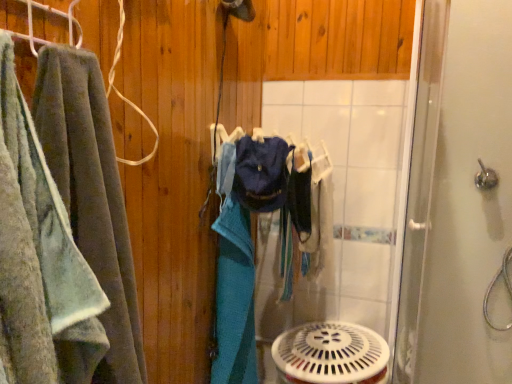
Question: Considering the relative sizes of white plastic mechanical fan at lower center and clear glass shower door at right in the image provided, is white plastic mechanical fan at lower center taller than clear glass shower door at right?

Choices:
 (A) no
 (B) yes

Answer: (A)

Question: Is the position of white plastic mechanical fan at lower center more distant than that of clear glass shower door at right?

Choices:
 (A) no
 (B) yes

Answer: (B)

Question: Could you tell me if white plastic mechanical fan at lower center is facing clear glass shower door at right?

Choices:
 (A) no
 (B) yes

Answer: (A)

Question: Can you confirm if white plastic mechanical fan at lower center is positioned to the left of clear glass shower door at right?

Choices:
 (A) no
 (B) yes

Answer: (B)

Question: Considering the relative sizes of white plastic mechanical fan at lower center and clear glass shower door at right in the image provided, is white plastic mechanical fan at lower center bigger than clear glass shower door at right?

Choices:
 (A) no
 (B) yes

Answer: (A)

Question: Considering the positions of point (62, 360) and point (484, 365), is point (62, 360) closer or farther from the camera than point (484, 365)?

Choices:
 (A) farther
 (B) closer

Answer: (B)

Question: Relative to clear glass shower door at right, is soft green towel at left in front or behind?

Choices:
 (A) behind
 (B) front

Answer: (B)

Question: Is soft green towel at left inside the boundaries of clear glass shower door at right, or outside?

Choices:
 (A) inside
 (B) outside

Answer: (B)

Question: From the image's perspective, relative to clear glass shower door at right, is soft green towel at left above or below?

Choices:
 (A) below
 (B) above

Answer: (B)

Question: Considering the positions of white plastic mechanical fan at lower center and silver metallic shower handle at upper right in the image, is white plastic mechanical fan at lower center bigger or smaller than silver metallic shower handle at upper right?

Choices:
 (A) big
 (B) small

Answer: (A)

Question: Is point (356, 382) positioned closer to the camera than point (479, 188)?

Choices:
 (A) farther
 (B) closer

Answer: (B)

Question: In terms of height, does white plastic mechanical fan at lower center look taller or shorter compared to silver metallic shower handle at upper right?

Choices:
 (A) tall
 (B) short

Answer: (A)

Question: From a real-world perspective, relative to silver metallic shower handle at upper right, is white plastic mechanical fan at lower center vertically above or below?

Choices:
 (A) below
 (B) above

Answer: (A)

Question: Is soft green towel at left bigger or smaller than silver metallic shower handle at upper right?

Choices:
 (A) small
 (B) big

Answer: (B)

Question: In terms of width, does soft green towel at left look wider or thinner when compared to silver metallic shower handle at upper right?

Choices:
 (A) thin
 (B) wide

Answer: (B)